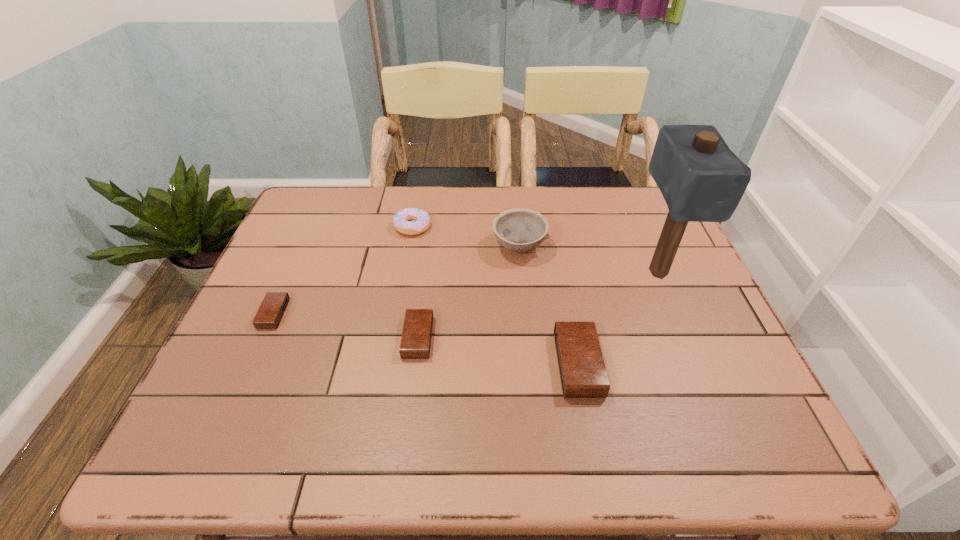
Locate an element on the screen. The height and width of the screenshot is (540, 960). free region at the far edge of the desktop is located at coordinates (455, 194).

The height and width of the screenshot is (540, 960). Find the location of `vacant space at the near edge of the desktop`. vacant space at the near edge of the desktop is located at coordinates (406, 392).

Find the location of a particular element. The width and height of the screenshot is (960, 540). vacant space at the right edge is located at coordinates (677, 334).

In the image, there is a desktop. Where is `free space at the far left corner`? free space at the far left corner is located at coordinates (318, 197).

Identify the location of vacant area that lies between the shortest object and the second alarm clock from left to right. The height and width of the screenshot is (540, 960). (346, 326).

Find the location of `vacant space that is in between the tallest object and the second alarm clock from right to left`. vacant space that is in between the tallest object and the second alarm clock from right to left is located at coordinates (538, 305).

The width and height of the screenshot is (960, 540). In order to click on free spot between the doughnut and the second tallest object in this screenshot , I will do `click(466, 237)`.

Identify the location of vacant region between the fifth shortest object and the doughnut. point(466,237).

Where is `vacant region between the tallest object and the doughnut`? The height and width of the screenshot is (540, 960). vacant region between the tallest object and the doughnut is located at coordinates (535, 249).

Where is `free spot between the leftmost object and the second tallest alarm clock`? The height and width of the screenshot is (540, 960). free spot between the leftmost object and the second tallest alarm clock is located at coordinates (346, 326).